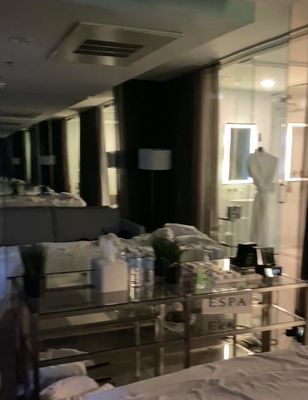
Identify the location of curtains. (95, 129), (59, 134), (178, 190).